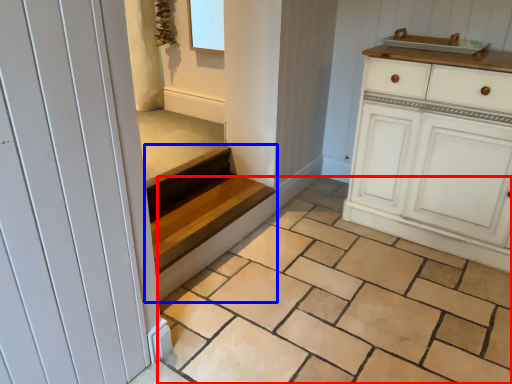
Question: Which object is closer to the camera taking this photo, tile (highlighted by a red box) or stairs (highlighted by a blue box)?

Choices:
 (A) tile
 (B) stairs

Answer: (A)